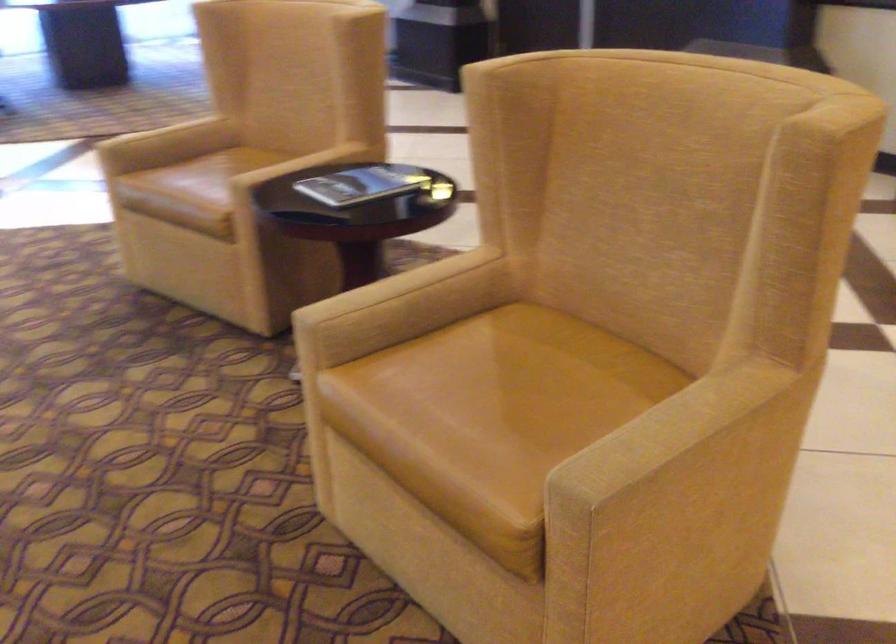
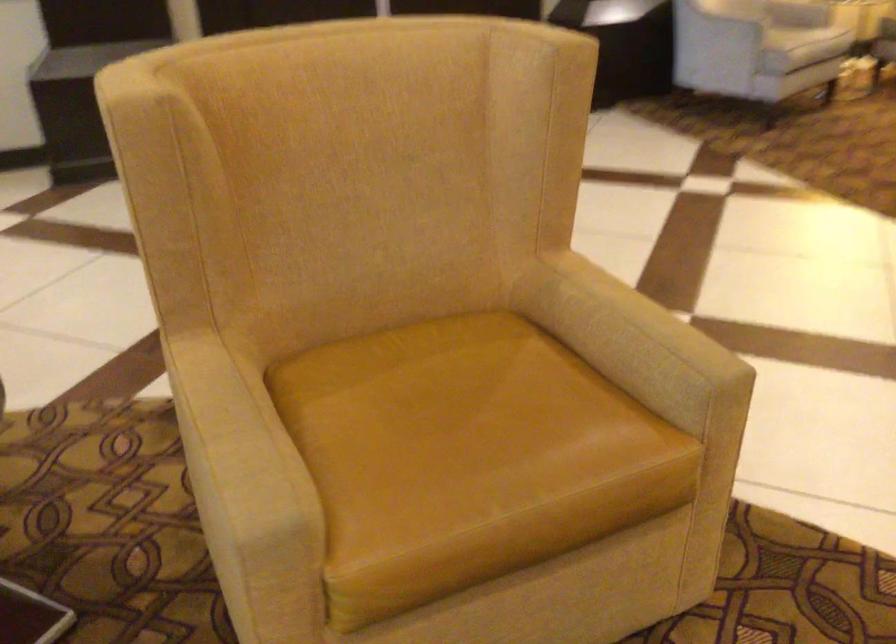
The point at [664,417] is marked in the first image. Where is the corresponding point in the second image?

(624, 322)